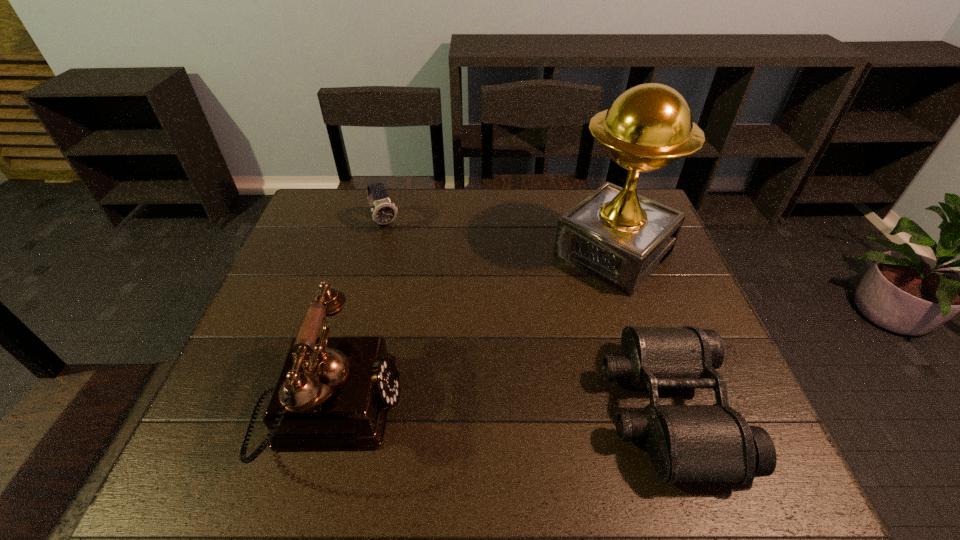
The height and width of the screenshot is (540, 960). In order to click on free space located 0.360m on the face of the third tallest object in this screenshot , I will do `click(431, 314)`.

You are a GUI agent. You are given a task and a screenshot of the screen. Output one action in this format:
    pyautogui.click(x=<x>, y=<y>)
    Task: Click on the free region located 0.120m on the front-facing side of the award
    
    Given the screenshot: What is the action you would take?
    pyautogui.click(x=554, y=309)

Identify the location of vacant position located on the front-facing side of the award. The height and width of the screenshot is (540, 960). (528, 334).

Where is `free location located on the front-facing side of the award`? The width and height of the screenshot is (960, 540). free location located on the front-facing side of the award is located at coordinates (498, 362).

Where is `watch that is at the far edge`? Image resolution: width=960 pixels, height=540 pixels. watch that is at the far edge is located at coordinates (384, 211).

Image resolution: width=960 pixels, height=540 pixels. I want to click on award present at the far edge, so click(x=615, y=235).

The width and height of the screenshot is (960, 540). I want to click on telephone present at the near edge, so click(x=333, y=392).

Locate an element on the screen. The width and height of the screenshot is (960, 540). binoculars that is positioned at the near edge is located at coordinates (686, 443).

The height and width of the screenshot is (540, 960). Find the location of `object located at the left edge`. object located at the left edge is located at coordinates (333, 392).

Identify the location of binoculars that is at the right edge. pos(686,443).